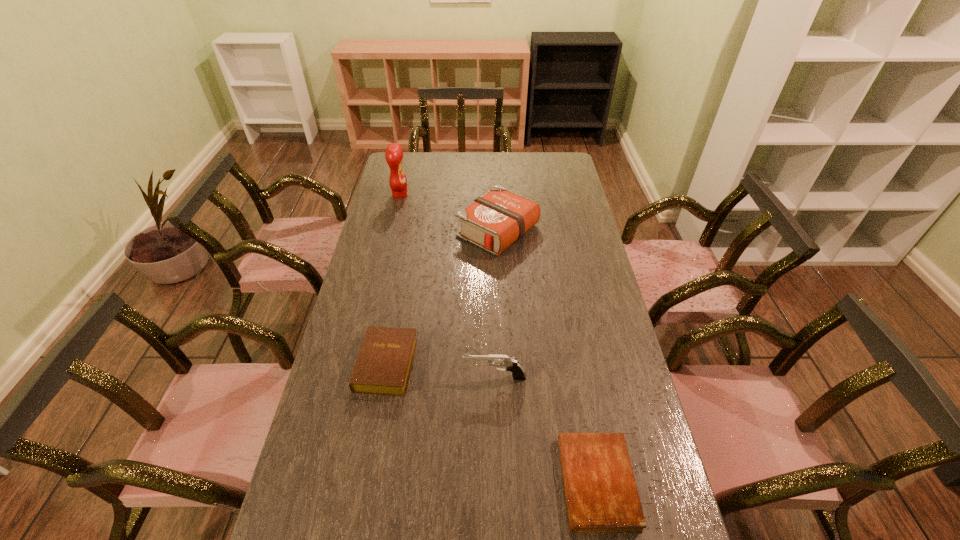
This screenshot has height=540, width=960. Identify the location of object situated at the right edge. (601, 493).

Identify the location of free location at the far edge of the desktop. (532, 157).

At what (x,y) coordinates should I click in order to perform the action: click on vacant space at the left edge of the desktop. Please return your answer as a coordinate pair (x, y). Looking at the image, I should click on (347, 404).

Image resolution: width=960 pixels, height=540 pixels. In the image, there is a desktop. In order to click on blank space at the right edge in this screenshot , I will do `click(570, 188)`.

Find the location of a particular element. This screenshot has width=960, height=540. free space at the far left corner is located at coordinates (412, 163).

The image size is (960, 540). I want to click on free spot between the leftmost Bible and the second farthest object, so click(x=442, y=298).

Where is `empty space between the gun and the second shortest Bible`? The image size is (960, 540). empty space between the gun and the second shortest Bible is located at coordinates (441, 371).

The image size is (960, 540). I want to click on vacant area that lies between the condiment and the fourth tallest object, so click(x=394, y=280).

At what (x,y) coordinates should I click in order to perform the action: click on free spot between the second farthest object and the tallest object. Please return your answer as a coordinate pair (x, y). The height and width of the screenshot is (540, 960). Looking at the image, I should click on (449, 213).

The image size is (960, 540). I want to click on free space between the farthest Bible and the tallest object, so click(x=449, y=213).